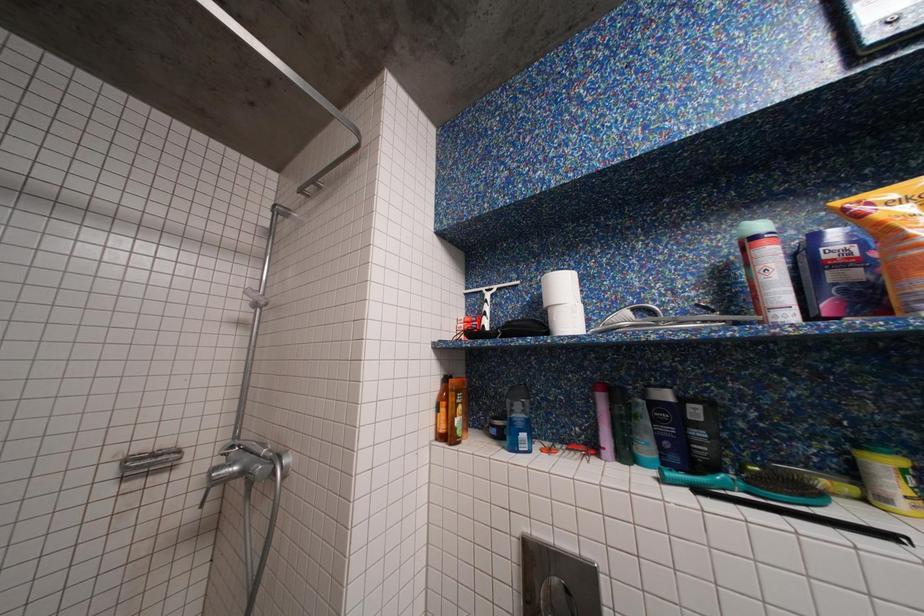
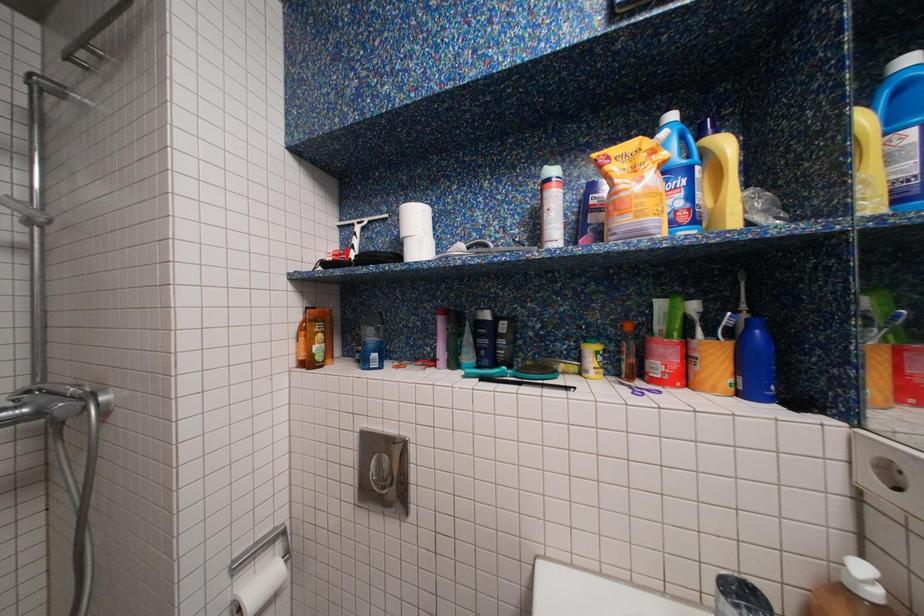
Question: Which direction would the cameraman need to move to produce the second image? Reply with the corresponding letter.

Choices:
 (A) Left
 (B) Right
 (C) Forward
 (D) Backward

Answer: (B)